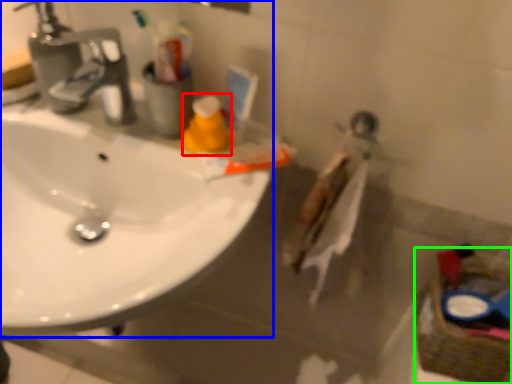
Question: Which object is positioned closest to cleaning product (highlighted by a red box)? Select from sink (highlighted by a blue box) and basket (highlighted by a green box).

Choices:
 (A) sink
 (B) basket

Answer: (A)